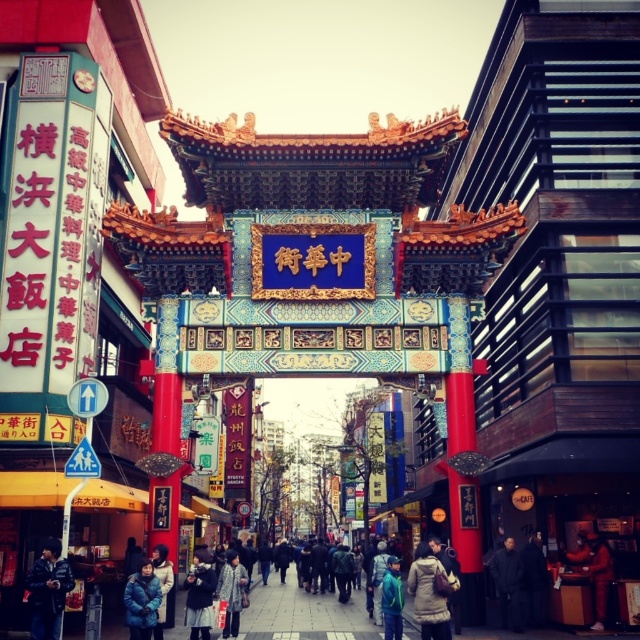
You are a fashion designer observing the vibrant urban scene with a traditional Chinese archway. You notice a light blue denim jacket at lower center and a white fur coat at center. Which clothing item appears taller in the image?

The light blue denim jacket at lower center has a greater height compared to the white fur coat at center, so the light blue denim jacket at lower center appears taller.

You are a delivery person who needs to deliver a package to the person wearing the white fur coat at center. You are currently standing next to the dark blue jacket at lower left. Considering the distance between them, can you estimate whether you can throw the package to reach them without leaving your current position?

The dark blue jacket at lower left and white fur coat at center are 11.62 meters apart. Since the distance is quite far, it is unlikely you can throw the package that far to reach them without moving from your current position.